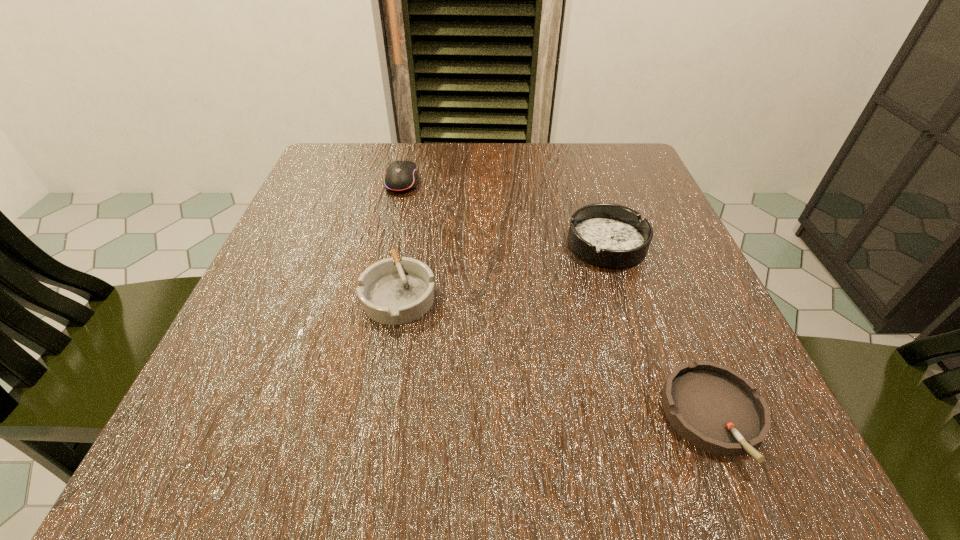
Where is `free spot between the nearest object and the farthest object`? The width and height of the screenshot is (960, 540). free spot between the nearest object and the farthest object is located at coordinates (558, 299).

Point out which object is positioned as the second nearest to the leftmost ashtray. Please provide its 2D coordinates. Your answer should be formatted as a tuple, i.e. [(x, y)], where the tuple contains the x and y coordinates of a point satisfying the conditions above.

[(607, 235)]

Identify which object is located as the second nearest to the computer mouse. Please provide its 2D coordinates. Your answer should be formatted as a tuple, i.e. [(x, y)], where the tuple contains the x and y coordinates of a point satisfying the conditions above.

[(607, 235)]

This screenshot has width=960, height=540. Identify the location of ashtray that is the closest to the nearest object. (607, 235).

What are the coordinates of `ashtray that stands as the second closest to the leftmost ashtray` in the screenshot? It's located at (718, 410).

Identify the location of vacant space that satisfies the following two spatial constraints: 1. on the front side of the leftmost ashtray; 2. on the left side of the farthest object. (375, 294).